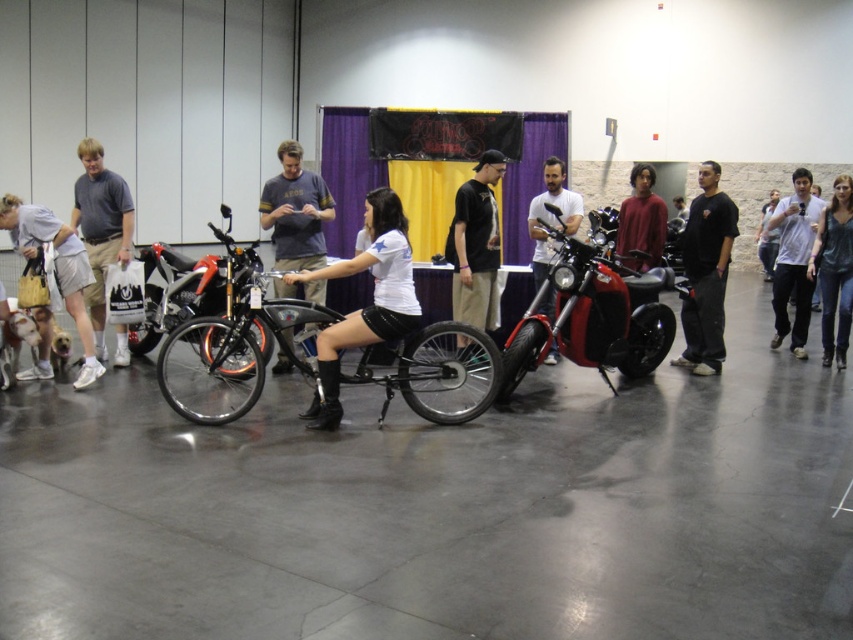
You are a photographer at the event and want to capture a photo of the white matte motorcycle at center without any people in the frame. Since the denim jeans at center is blocking the view, which direction should you move to the left or right to get a clear shot?

The denim jeans at center is on the right side of the white matte motorcycle at center. To avoid blocking, move to the left side of the motorcycle.